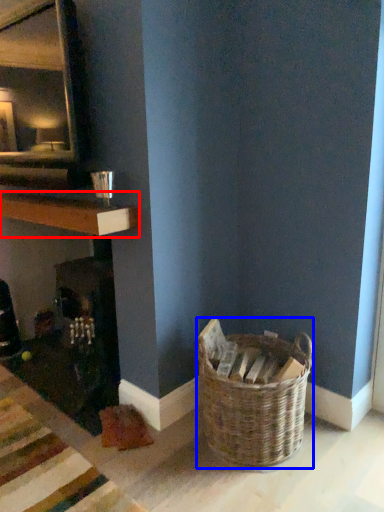
Question: Which object is further to the camera taking this photo, shelf (highlighted by a red box) or picnic basket (highlighted by a blue box)?

Choices:
 (A) shelf
 (B) picnic basket

Answer: (A)